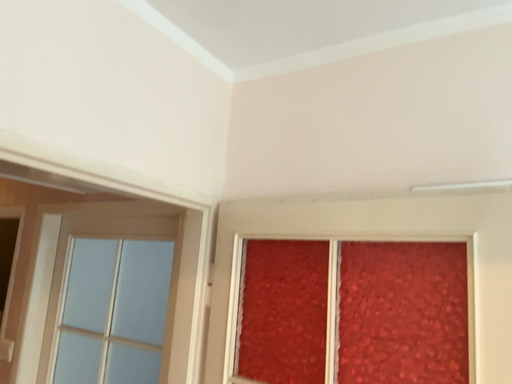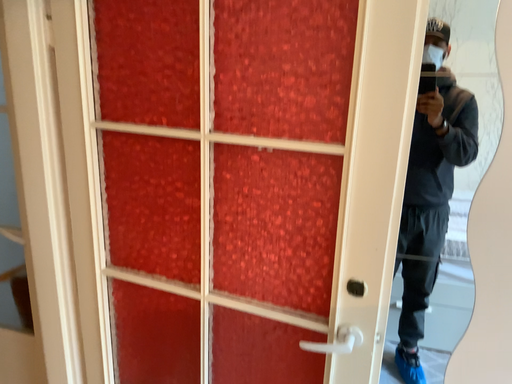
Question: Which way did the camera rotate in the video?

Choices:
 (A) rotated left
 (B) rotated right

Answer: (B)